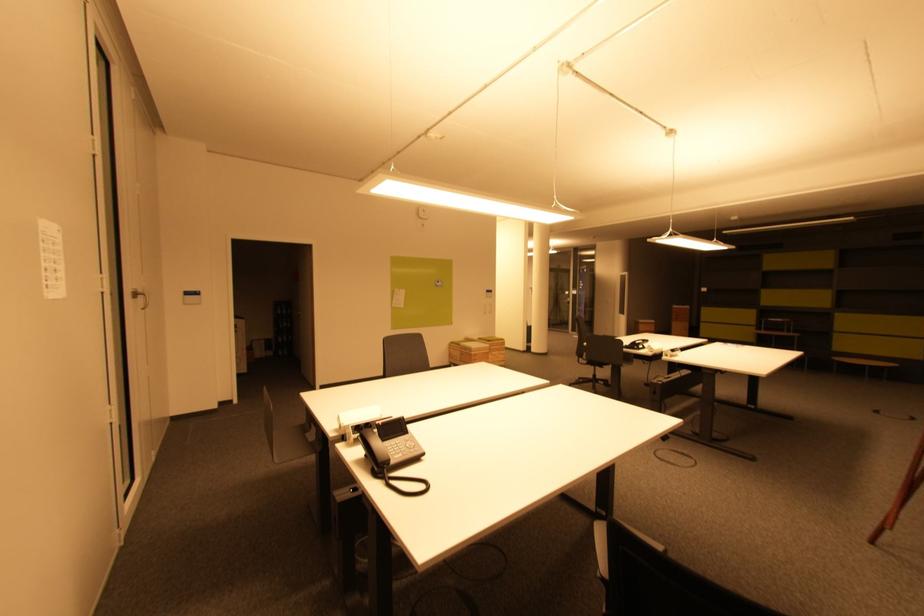
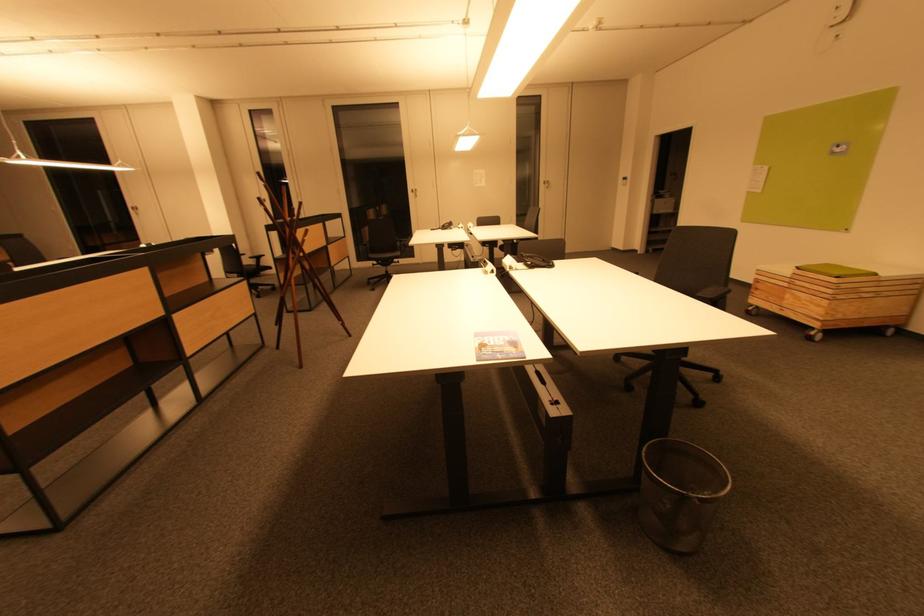
The point at (504,357) is marked in the first image. Where is the corresponding point in the second image?

(816, 305)